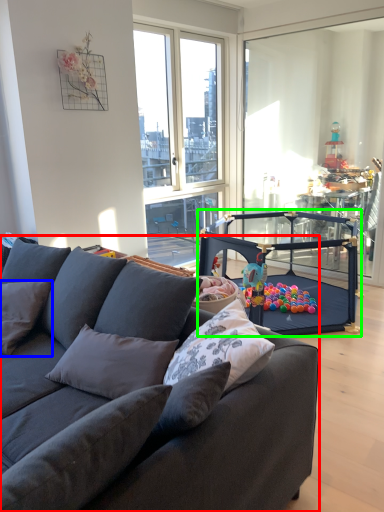
Question: Which object is the farthest from studio couch (highlighted by a red box)? Choose among these: pillow (highlighted by a blue box) or armchair (highlighted by a green box).

Choices:
 (A) pillow
 (B) armchair

Answer: (B)